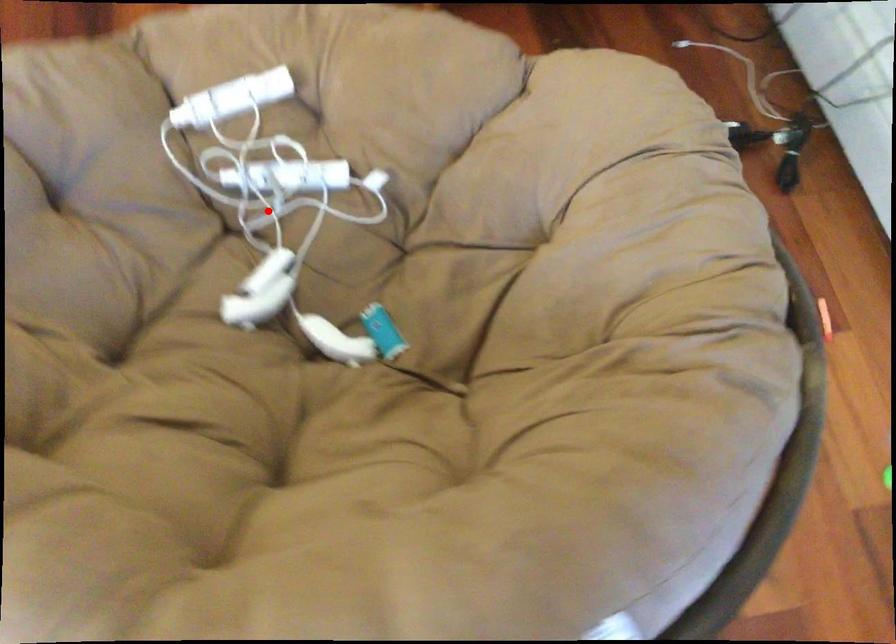
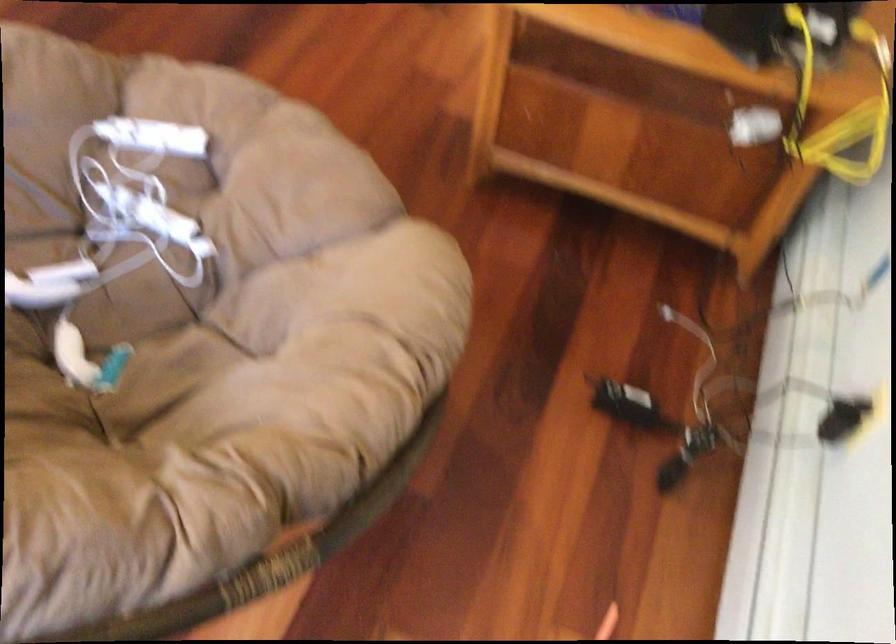
Find the pixel in the second image that matches the highlighted location in the first image.

(113, 236)